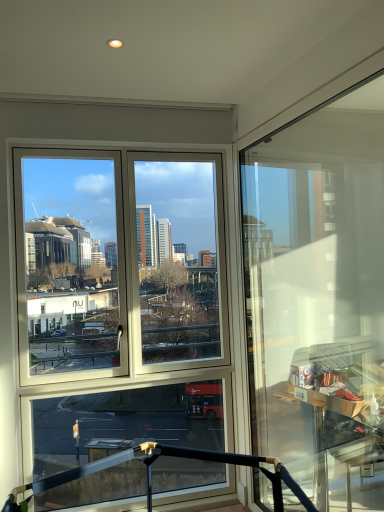
The height and width of the screenshot is (512, 384). Describe the element at coordinates (319, 298) in the screenshot. I see `transparent glass table at right` at that location.

Image resolution: width=384 pixels, height=512 pixels. Find the location of `transparent glass table at right`. transparent glass table at right is located at coordinates (319, 298).

In order to face transparent glass table at right, should I rotate leftwards or rightwards?

It's best to rotate right around 14.253 degrees.

Identify the location of transparent glass table at right. (319, 298).